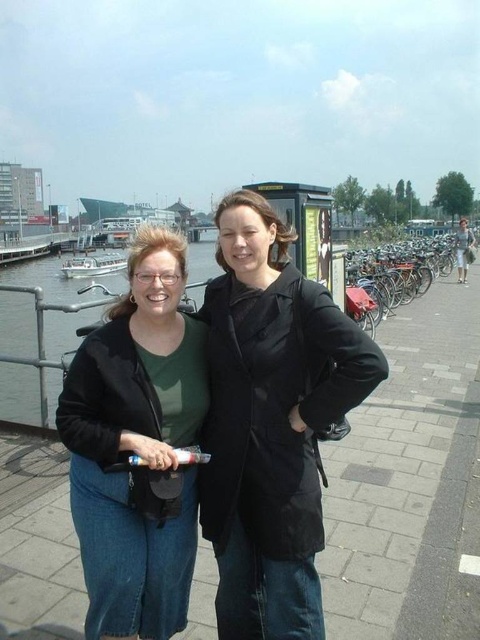
Question: Which point is closer to the camera taking this photo?

Choices:
 (A) (349, 472)
 (B) (162, 624)

Answer: (B)

Question: Is black matte coat at center further to the viewer compared to green matte shirt at center?

Choices:
 (A) yes
 (B) no

Answer: (A)

Question: Can you confirm if paved stone sidewalk at center is thinner than black matte coat at center?

Choices:
 (A) yes
 (B) no

Answer: (B)

Question: Which point is closer to the camera?

Choices:
 (A) paved stone sidewalk at center
 (B) black matte coat at center

Answer: (B)

Question: Does black matte coat at center have a larger size compared to green matte shirt at center?

Choices:
 (A) yes
 (B) no

Answer: (B)

Question: Which point appears farthest from the camera in this image?

Choices:
 (A) (97, 442)
 (B) (363, 566)
 (C) (284, 369)

Answer: (B)